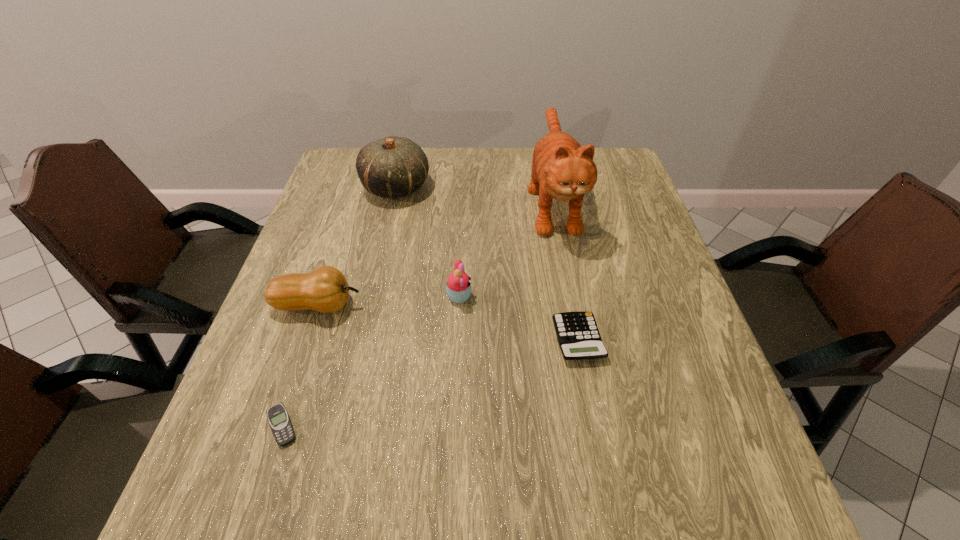
Identify the location of free spot at the left edge of the desktop. (371, 210).

This screenshot has height=540, width=960. I want to click on vacant point at the right edge, so click(x=694, y=343).

The image size is (960, 540). In order to click on vacant space at the far left corner of the desktop in this screenshot , I will do `click(345, 159)`.

In order to click on free space between the fourth object from left to right and the beeper in this screenshot , I will do `click(371, 361)`.

Find the location of a particular element. vacant area that lies between the farther gourd and the fourth object from left to right is located at coordinates (428, 242).

This screenshot has height=540, width=960. What are the coordinates of `free area in between the cat and the third object from right to left` in the screenshot? It's located at (506, 248).

I want to click on free space between the shortest object and the cupcake, so click(x=371, y=361).

Find the location of a particular element. empty space between the cupcake and the tallest object is located at coordinates (506, 248).

Where is `free space between the cat and the nearer gourd`? The height and width of the screenshot is (540, 960). free space between the cat and the nearer gourd is located at coordinates (436, 253).

At what (x,y) coordinates should I click in order to perform the action: click on free space between the shorter gourd and the calculator. Please return your answer as a coordinate pair (x, y). The height and width of the screenshot is (540, 960). Looking at the image, I should click on (448, 322).